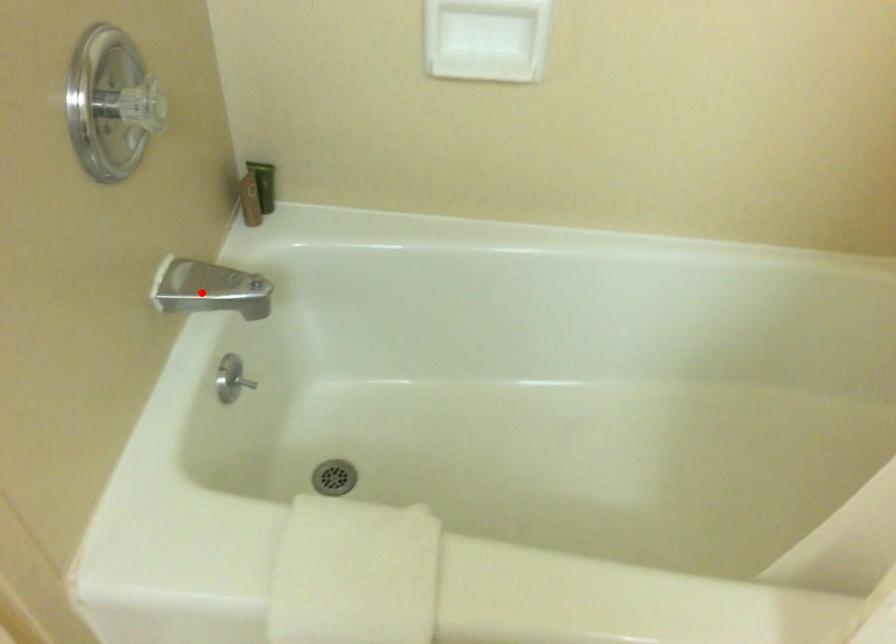
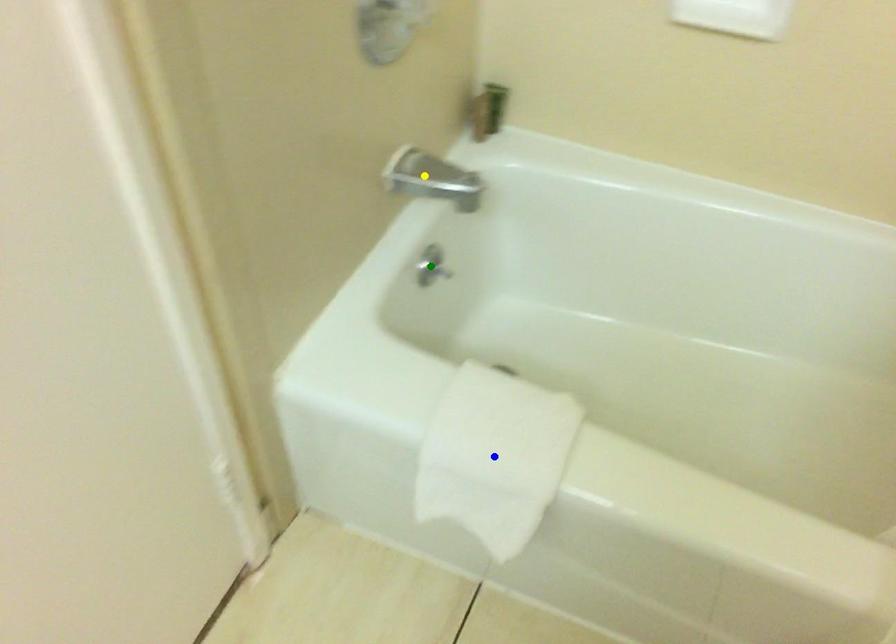
Question: I am providing you with two images of the same scene from different viewpoints. A red point is marked on the first image. You are given multiple points on the second image. Which point in image 2 is actually the same real-world point as the red point in image 1?

Choices:
 (A) green point
 (B) blue point
 (C) yellow point

Answer: (C)